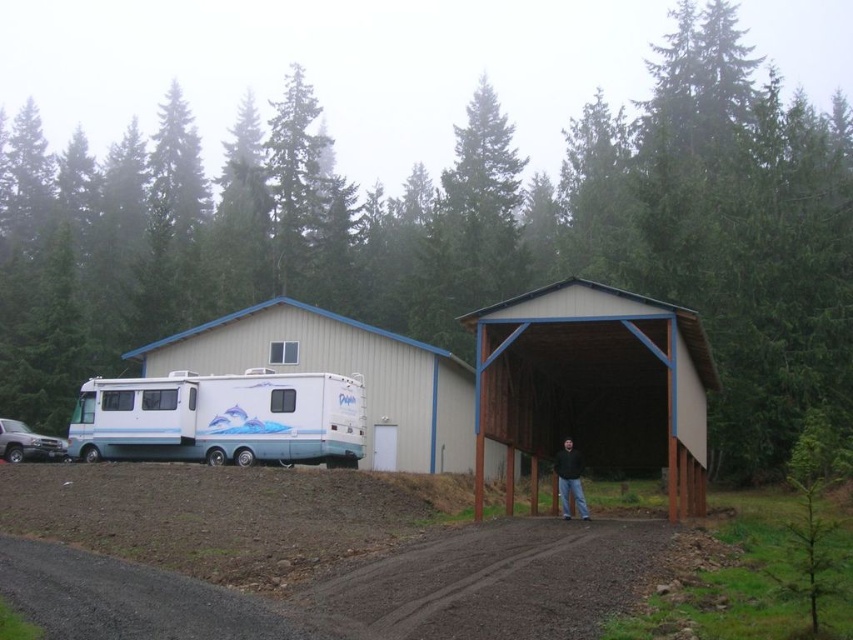
Question: Is white glossy recreational vehicle at left wider than brushed metal truck at lower left?

Choices:
 (A) no
 (B) yes

Answer: (B)

Question: Based on their relative distances, which object is nearer to the white glossy rv at center?

Choices:
 (A) white glossy recreational vehicle at left
 (B) brown wooden shed at center

Answer: (A)

Question: From the image, what is the correct spatial relationship of brown gravel dirt track at center in relation to brushed metal truck at lower left?

Choices:
 (A) above
 (B) below

Answer: (A)

Question: Is white glossy rv at center below black matte jacket at lower center?

Choices:
 (A) no
 (B) yes

Answer: (A)

Question: Among these points, which one is nearest to the camera?

Choices:
 (A) (703, 444)
 (B) (558, 483)

Answer: (A)

Question: Which of the following is the closest to the observer?

Choices:
 (A) (x=190, y=404)
 (B) (x=561, y=500)

Answer: (B)